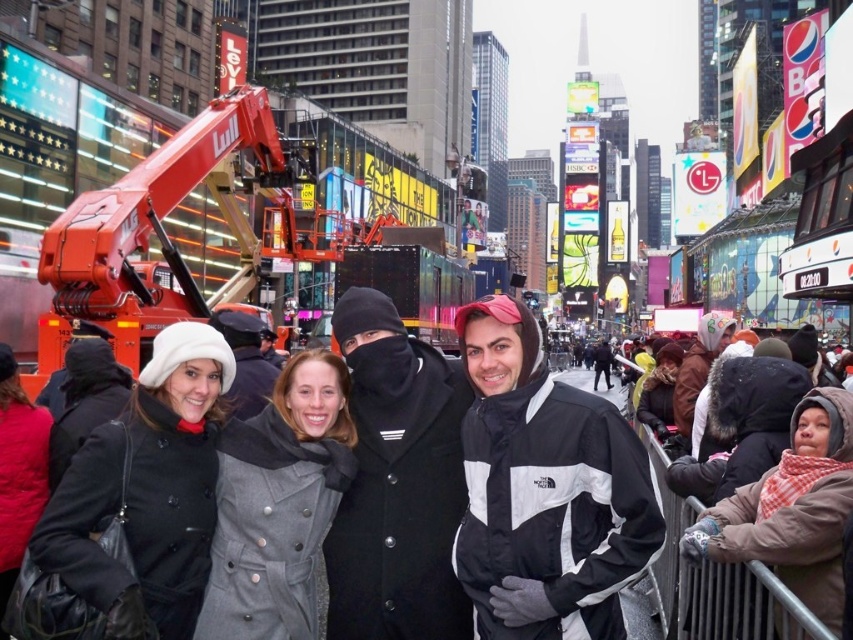
You are standing in Times Square and want to take a photo of two specific points marked as point 1 at coordinates (88, 468) and point 2 at coordinates (230, 337). Which point should you focus on first if you want to capture them in the order they appear from your perspective?

Point 1 at coordinates (88, 468) should be focused on first because it is in front of point 2 at coordinates (230, 337) from your perspective.